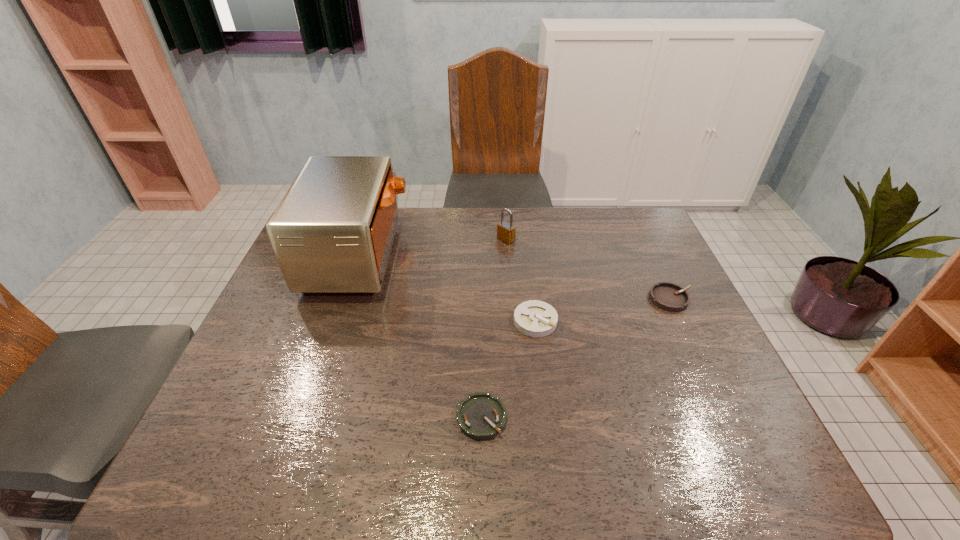
Where is `vacant area that lies between the padlock and the rightmost ashtray`? vacant area that lies between the padlock and the rightmost ashtray is located at coordinates (588, 269).

Identify the location of empty space that is in between the second ashtray from left to right and the padlock. (520, 280).

You are a GUI agent. You are given a task and a screenshot of the screen. Output one action in this format:
    pyautogui.click(x=<x>, y=<y>)
    Task: Click on the free area in between the shortest ashtray and the rightmost object
    
    Given the screenshot: What is the action you would take?
    pyautogui.click(x=576, y=358)

Locate an element on the screen. The width and height of the screenshot is (960, 540). object identified as the closest to the shortest ashtray is located at coordinates (534, 318).

Identify the location of object that is the third closest to the leftmost ashtray. (667, 296).

What are the coordinates of `ashtray that is the third nearest to the padlock` in the screenshot? It's located at (481, 416).

Choose which ashtray is the third nearest neighbor to the fourth shortest object. Please provide its 2D coordinates. Your answer should be formatted as a tuple, i.e. [(x, y)], where the tuple contains the x and y coordinates of a point satisfying the conditions above.

[(481, 416)]

At what (x,y) coordinates should I click in order to perform the action: click on blank space that satisfies the following two spatial constraints: 1. on the back side of the padlock; 2. on the left side of the leftmost ashtray. Please return your answer as a coordinate pair (x, y). Looking at the image, I should click on (481, 239).

The width and height of the screenshot is (960, 540). I want to click on vacant region that satisfies the following two spatial constraints: 1. on the back side of the rightmost ashtray; 2. on the right side of the second ashtray from left to right, so click(x=533, y=299).

Where is `free space that satisfies the following two spatial constraints: 1. on the back side of the second ashtray from left to right; 2. on the right side of the rightmost ashtray`? The image size is (960, 540). free space that satisfies the following two spatial constraints: 1. on the back side of the second ashtray from left to right; 2. on the right side of the rightmost ashtray is located at coordinates (533, 299).